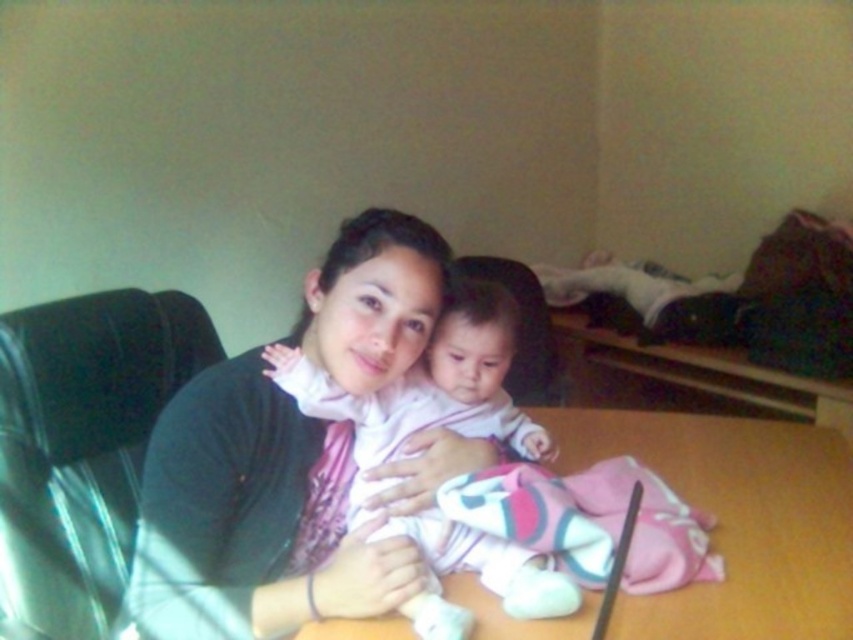
In the scene shown: You are a photographer setting up for a family portrait. You need to ensure that both the wooden table at center and the pink soft fabric baby at center are clearly visible in the shot. Based on their positioning, which object is closer to the camera?

The pink soft fabric baby at center is closer to the camera because the wooden table at center is positioned under it.

You are trying to place a small gift box between the wooden table at center and the pink soft fabric baby at center. Based on their positions, which object should the gift box be closer to?

The wooden table at center is to the right of the pink soft fabric baby at center, so the gift box should be placed closer to the baby since it is on the left side.